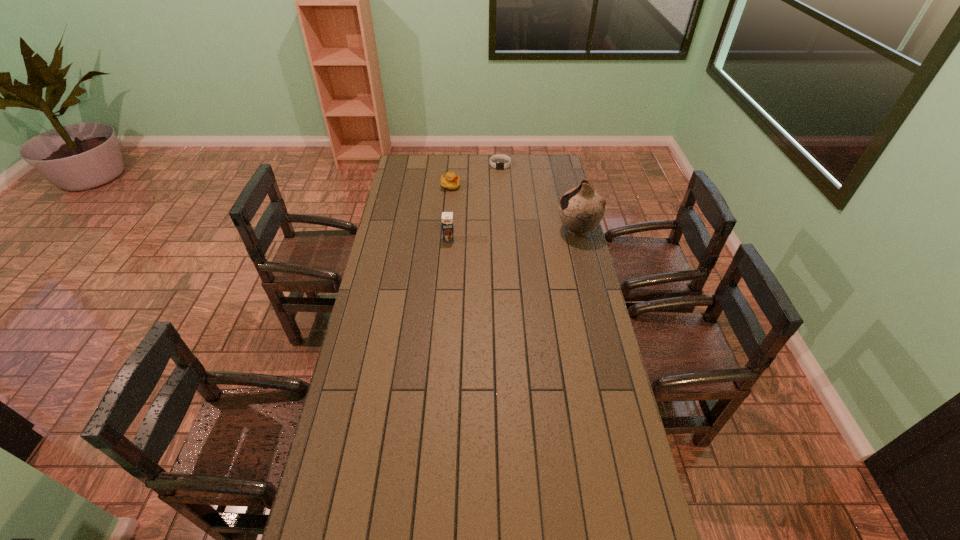
Image resolution: width=960 pixels, height=540 pixels. I want to click on the third shortest object, so click(447, 217).

Identify the location of the tallest object. This screenshot has width=960, height=540. (581, 209).

Where is `the rightmost object`? the rightmost object is located at coordinates (581, 209).

Identify the location of the farthest object. (498, 165).

Find the location of a particular element. Image resolution: width=960 pixels, height=540 pixels. wristband is located at coordinates (498, 165).

At what (x,y) coordinates should I click in order to perform the action: click on duckling. Please return your answer as a coordinate pair (x, y). The width and height of the screenshot is (960, 540). Looking at the image, I should click on (450, 181).

Locate an element on the screen. The width and height of the screenshot is (960, 540). the second shortest object is located at coordinates (450, 181).

In order to click on free space located 0.180m on the front label of the chocolate milk in this screenshot , I will do `click(446, 270)`.

Locate an element on the screen. The image size is (960, 540). vacant area situated 0.330m from the spout of the pottery is located at coordinates (486, 230).

You are a GUI agent. You are given a task and a screenshot of the screen. Output one action in this format:
    pyautogui.click(x=<x>, y=<y>)
    Task: Click on the free space located 0.180m from the spout of the pottery
    This screenshot has width=960, height=540.
    Given the screenshot: What is the action you would take?
    pyautogui.click(x=517, y=230)